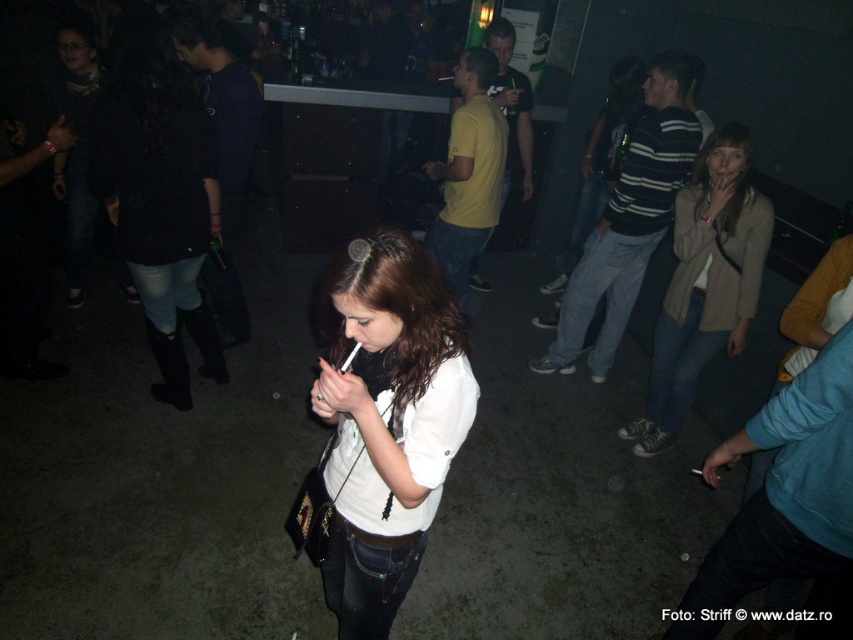
You are standing at the entrance of the bar and want to walk to the point marked as point (433, 433). However, there is an obstacle at point (646, 392). Will you encounter the obstacle before reaching your destination?

Point (433, 433) is in front of point (646, 392), so you will reach the destination before encountering the obstacle.

You are at a bar and see two items of clothing in the scene. The white matte shirt at center and the beige textured coat at right. Which one is positioned more to the left?

The white matte shirt at center is positioned more to the left than the beige textured coat at right.

You are a photographer at the scene. You want to capture a photo that includes both the white matte shirt at center and the beige textured coat at right. Based on their positions, which one should you ensure is closer to the camera to include both in the frame?

The white matte shirt at center is positioned under the beige textured coat at right, so to include both in the frame, you should ensure the beige textured coat at right is closer to the camera.